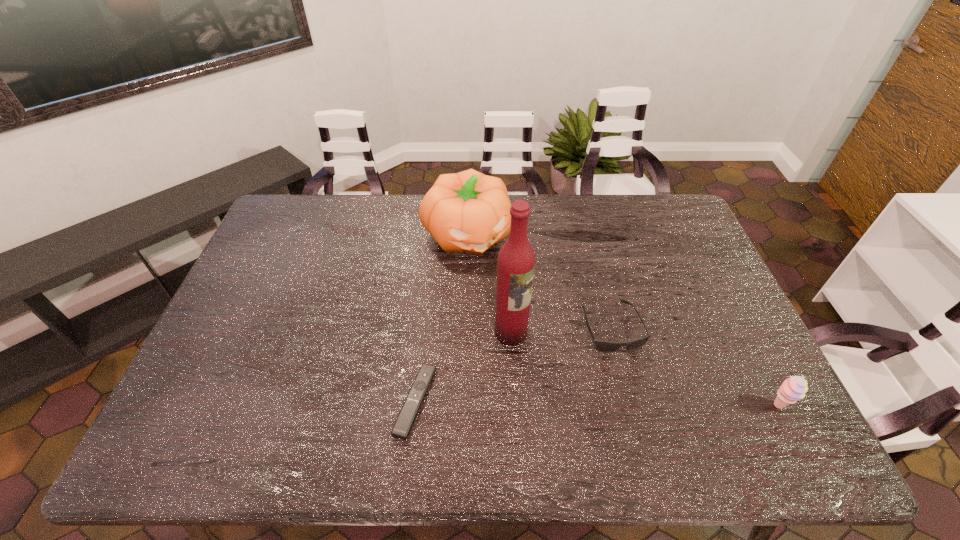
The height and width of the screenshot is (540, 960). I want to click on free space on the desktop that is between the shortest object and the rightmost object and is positioned on the carved face of the pumpkin, so click(x=556, y=403).

Where is `vacant space on the desktop that is between the remote control and the third shortest object and is positioned on the label of the tallest object`? Image resolution: width=960 pixels, height=540 pixels. vacant space on the desktop that is between the remote control and the third shortest object and is positioned on the label of the tallest object is located at coordinates (605, 403).

The image size is (960, 540). What are the coordinates of `vacant space on the desktop that is between the remote control and the sherbert and is positioned on the front-facing side of the second object from right to left` in the screenshot? It's located at (643, 404).